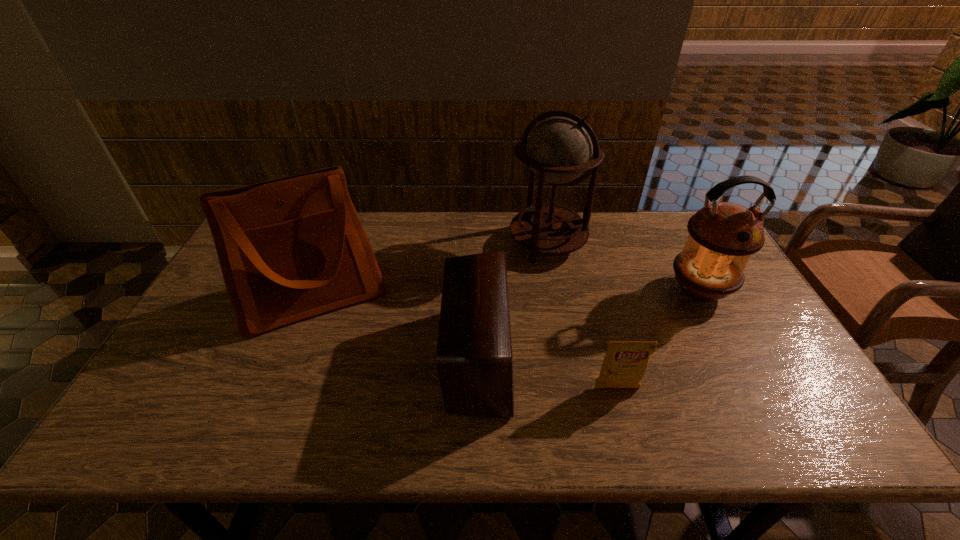
I want to click on globe, so click(559, 149).

I want to click on the leftmost object, so click(x=291, y=248).

Locate an element on the screen. the rightmost object is located at coordinates (723, 236).

Identify the location of radio receiver. (474, 361).

Identify the location of the second shortest object. (474, 361).

Locate an element on the screen. the shortest object is located at coordinates (624, 365).

The image size is (960, 540). I want to click on free spot located 0.240m on the surface of the globe, so click(x=563, y=326).

The image size is (960, 540). Find the location of `vacant space situated on the back of the shopping bag`. vacant space situated on the back of the shopping bag is located at coordinates pyautogui.click(x=338, y=235).

This screenshot has width=960, height=540. I want to click on vacant area situated 0.110m on the front of the oil lamp, so click(x=728, y=345).

At what (x,y) coordinates should I click in order to perform the action: click on free space located 0.220m on the front-facing side of the radio receiver. Please return your answer as a coordinate pair (x, y). The height and width of the screenshot is (540, 960). Looking at the image, I should click on (597, 357).